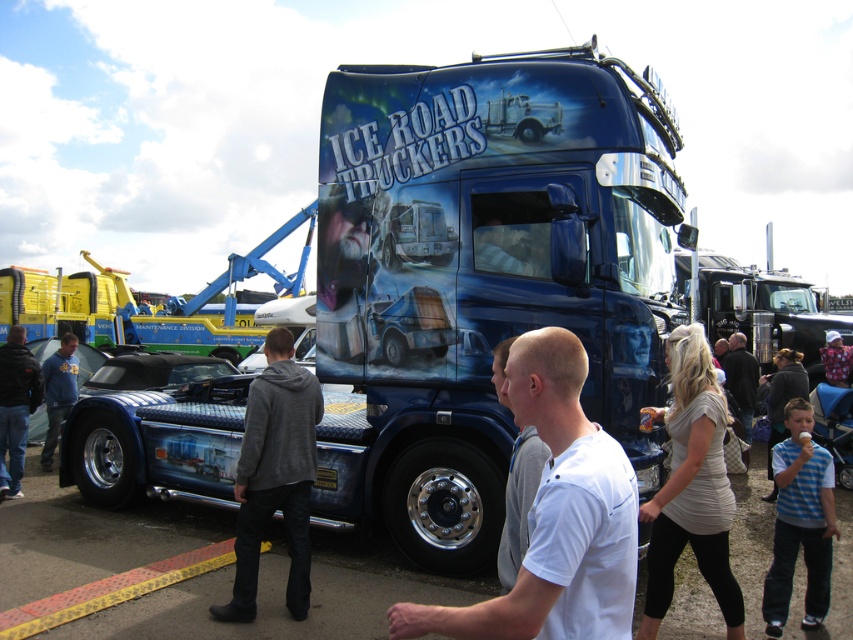
Question: Does glossy metallic truck at center come in front of blue hoodie at left?

Choices:
 (A) no
 (B) yes

Answer: (B)

Question: Which of the following is the closest to the observer?

Choices:
 (A) (253, 476)
 (B) (368, 97)
 (C) (537, 355)

Answer: (C)

Question: Does glossy metallic truck at center lie in front of blue striped shirt at lower right?

Choices:
 (A) yes
 (B) no

Answer: (B)

Question: Which object is the farthest from the dark gray sweater at center?

Choices:
 (A) glossy metallic truck at center
 (B) blue striped shirt at lower right
 (C) white matte shirt at center
 (D) blue hoodie at left

Answer: (D)

Question: Which object appears farthest from the camera in this image?

Choices:
 (A) glossy metallic truck at center
 (B) dark gray hoodie at left
 (C) dark gray sweater at center
 (D) blue hoodie at left

Answer: (C)

Question: Is glossy metallic truck at center wider than white matte shirt at center?

Choices:
 (A) yes
 (B) no

Answer: (A)